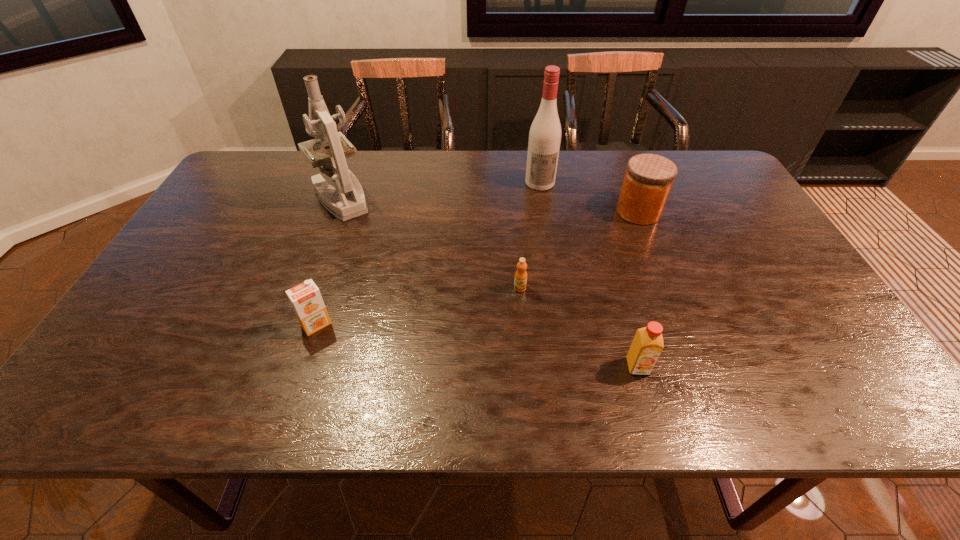
Identify the location of blank space located on the label of the alcohol. (543, 203).

Image resolution: width=960 pixels, height=540 pixels. I want to click on vacant region located 0.130m on the right of the rightmost object, so pos(704,212).

Where is `blank space located on the left of the fifth farthest object`? The width and height of the screenshot is (960, 540). blank space located on the left of the fifth farthest object is located at coordinates (223, 325).

Find the location of `vacant space located on the front label of the shortest orange juice`. vacant space located on the front label of the shortest orange juice is located at coordinates (529, 391).

Identify the location of microscope at the far edge. (347, 200).

You are a GUI agent. You are given a task and a screenshot of the screen. Output one action in this format:
    pyautogui.click(x=<x>, y=<y>)
    Task: Click on the alcohol at the far edge
    The height and width of the screenshot is (540, 960).
    Given the screenshot: What is the action you would take?
    pyautogui.click(x=545, y=132)

This screenshot has height=540, width=960. I want to click on object situated at the near edge, so click(647, 345).

In the image, there is a desktop. Where is `vacant space at the far edge`? The width and height of the screenshot is (960, 540). vacant space at the far edge is located at coordinates (460, 184).

Locate an element on the screen. The width and height of the screenshot is (960, 540). vacant space at the near edge of the desktop is located at coordinates (494, 388).

The image size is (960, 540). In the image, there is a desktop. In order to click on vacant space at the left edge in this screenshot , I will do `click(236, 218)`.